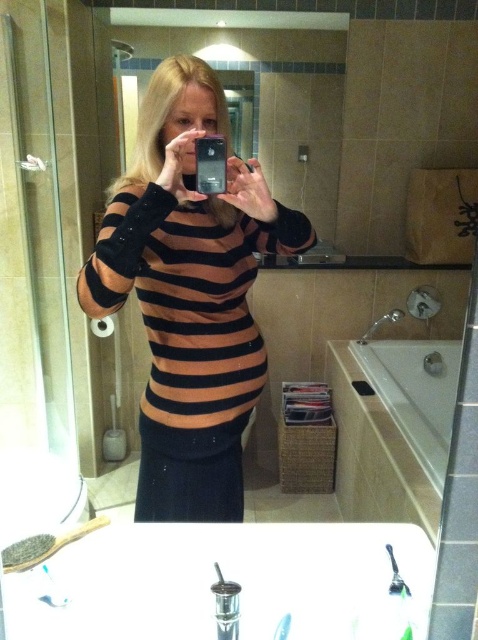
You are a photographer trying to capture a photo of the bathroom scene. The black striped sweater at center and the white glossy bathtub at lower right are both in the frame. Based on their sizes in the image, which object appears taller?

The black striped sweater at center appears taller than the white glossy bathtub at lower right in the image.